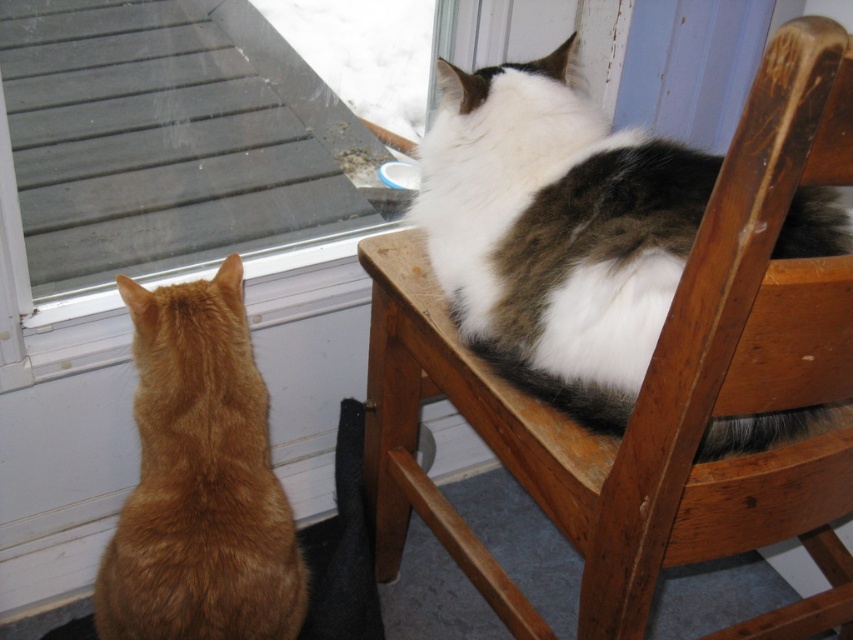
You are trying to decide whether to place a rectangular box that is 1.2 meters wide on the floor between the wooden chair at upper right and the orange fur cat at left. Based on their widths, can the box fit between them?

The wooden chair at upper right is wider than the orange fur cat at left. However, the combined width of both objects is not provided, so it is impossible to determine if the box will fit between them.